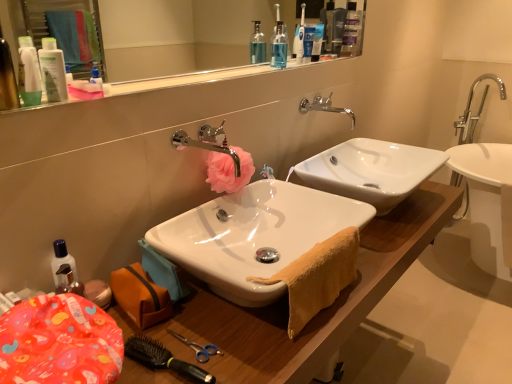
Image resolution: width=512 pixels, height=384 pixels. I want to click on vacant space behind black rubber brush at lower left, the 2th brush in the back-to-front sequence, so click(199, 318).